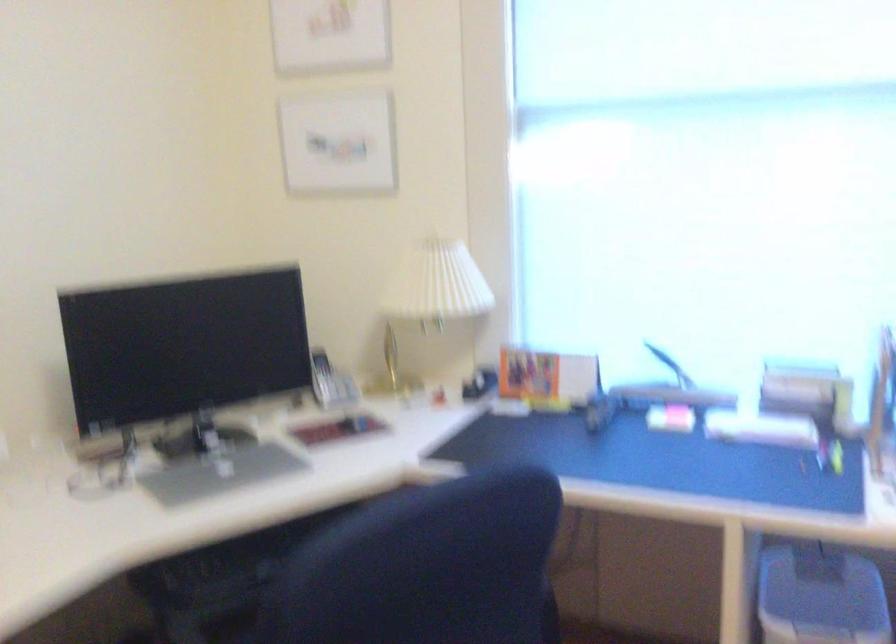
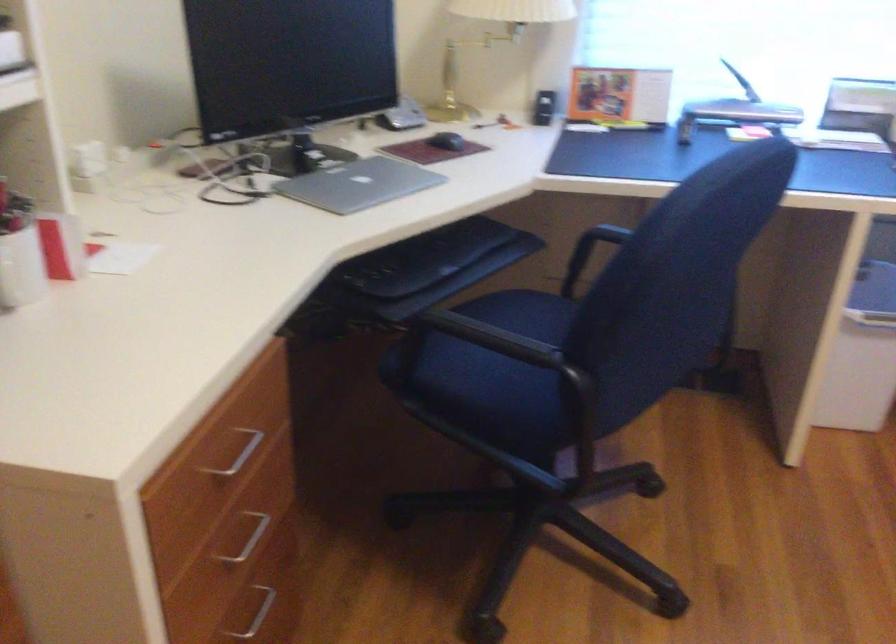
In the second image, find the point that corresponds to pixel 345 426 in the first image.

(446, 140)